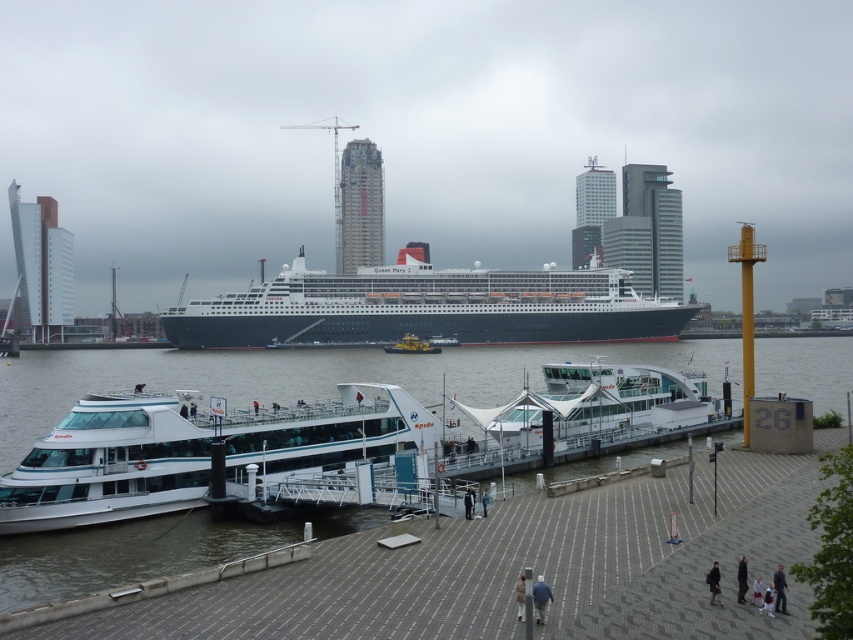
Does white glossy ferry at lower left have a larger size compared to dark blue uniform at center?

Correct, white glossy ferry at lower left is larger in size than dark blue uniform at center.

Can you confirm if white glossy ferry at lower left is thinner than dark blue uniform at center?

No.

Who is more distant from viewer, (109,410) or (468,509)?

Positioned behind is point (109,410).

Locate an element on the screen. white glossy ferry at lower left is located at coordinates (109, 465).

Is point (758, 582) in front of point (485, 492)?

Yes, point (758, 582) is in front of point (485, 492).

Based on the photo, can you confirm if light pink fabric pants at lower right is thinner than light blue fabric jacket at lower center?

Indeed, light pink fabric pants at lower right has a lesser width compared to light blue fabric jacket at lower center.

Who is more distant from viewer, (759, 589) or (486, 486)?

Positioned behind is point (486, 486).

Where is `light pink fabric pants at lower right`? light pink fabric pants at lower right is located at coordinates (757, 592).

Can you confirm if white concrete dock at lower center is positioned above light brown leather jacket at lower right?

Incorrect, white concrete dock at lower center is not positioned above light brown leather jacket at lower right.

Does point (479, 602) come closer to viewer compared to point (776, 576)?

No, it is behind (776, 576).

Where is `white concrete dock at lower center`? The width and height of the screenshot is (853, 640). white concrete dock at lower center is located at coordinates (517, 570).